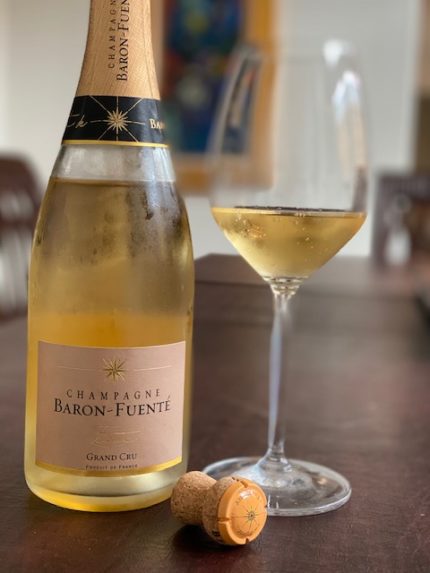
Where is `chair in background behind glass`? Image resolution: width=430 pixels, height=573 pixels. chair in background behind glass is located at coordinates 416,204.